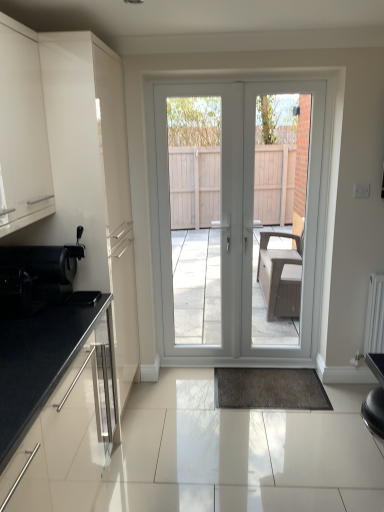
Question: Considering the relative sizes of white plastic door at center, the 1th screen door viewed from the right, and shiny black coffee machine at left in the image provided, is white plastic door at center, the 1th screen door viewed from the right, thinner than shiny black coffee machine at left?

Choices:
 (A) yes
 (B) no

Answer: (A)

Question: Are white plastic door at center, arranged as the second screen door when viewed from the left, and shiny black coffee machine at left located far from each other?

Choices:
 (A) no
 (B) yes

Answer: (B)

Question: Does white plastic door at center, arranged as the second screen door when viewed from the left, have a smaller size compared to shiny black coffee machine at left?

Choices:
 (A) yes
 (B) no

Answer: (B)

Question: Can you confirm if white plastic door at center, arranged as the second screen door when viewed from the left, is wider than shiny black coffee machine at left?

Choices:
 (A) yes
 (B) no

Answer: (B)

Question: From the image's perspective, is white plastic door at center, the 1th screen door viewed from the right, on shiny black coffee machine at left?

Choices:
 (A) yes
 (B) no

Answer: (A)

Question: Does white plastic door at center, the 1th screen door viewed from the right, touch shiny black coffee machine at left?

Choices:
 (A) no
 (B) yes

Answer: (A)

Question: Does black granite countertop at lower left, arranged as the first cabinetry when ordered from the bottom, turn towards matte white cabinet at left, which is the first cabinetry in top-to-bottom order?

Choices:
 (A) yes
 (B) no

Answer: (B)

Question: From a real-world perspective, is black granite countertop at lower left, positioned as the second cabinetry in top-to-bottom order, beneath matte white cabinet at left, which is the first cabinetry in top-to-bottom order?

Choices:
 (A) yes
 (B) no

Answer: (A)

Question: Is black granite countertop at lower left, arranged as the first cabinetry when ordered from the bottom, thinner than matte white cabinet at left, the second cabinetry from the bottom?

Choices:
 (A) yes
 (B) no

Answer: (B)

Question: Is black granite countertop at lower left, arranged as the first cabinetry when ordered from the bottom, bigger than matte white cabinet at left, which is the first cabinetry in top-to-bottom order?

Choices:
 (A) yes
 (B) no

Answer: (B)

Question: Is black granite countertop at lower left, arranged as the first cabinetry when ordered from the bottom, shorter than matte white cabinet at left, the second cabinetry from the bottom?

Choices:
 (A) no
 (B) yes

Answer: (B)

Question: Is black granite countertop at lower left, positioned as the second cabinetry in top-to-bottom order, not within matte white cabinet at left, which is the first cabinetry in top-to-bottom order?

Choices:
 (A) no
 (B) yes

Answer: (B)

Question: Does shiny black coffee machine at left have a greater height compared to white plastic door at center, arranged as the second screen door when viewed from the left?

Choices:
 (A) yes
 (B) no

Answer: (B)